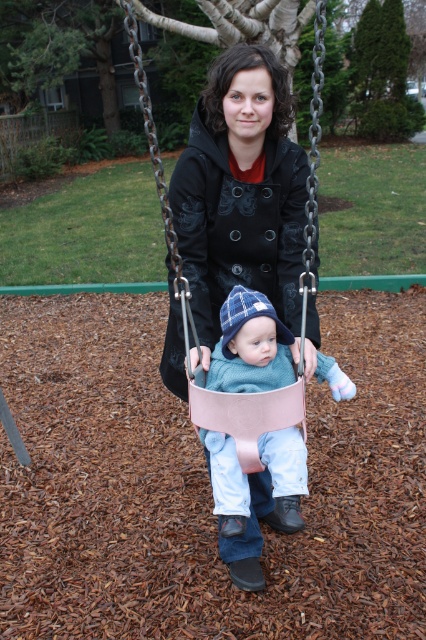
In the scene shown: You are standing at the center of the playground and want to find the pink leather swing at center. According to the coordinates given, in which direction should you look to locate it?

The pink leather swing at center is located at coordinates point [244,189], so you should look to the left from the center of the playground to find it.

You are a parent at the playground and want to ensure your child is safe while swinging. Given the pink leather swing at center and the light blue knit sweater at center, which object would you focus on to ensure the swing is secure?

The pink leather swing at center is bigger than the light blue knit sweater at center, so you should focus on the pink leather swing at center to ensure it is securely attached and safe for the child.

You are a photographer taking a picture of the playground scene. You want to focus on the pink leather swing at center and the light blue knit sweater at center. Which object should you adjust your camera focus on first if you want to ensure both are in focus?

The pink leather swing at center is closer to the viewer than the light blue knit sweater at center, so you should focus on the pink leather swing at center first. This will ensure the light blue knit sweater at center, which is farther away, remains in focus as well.